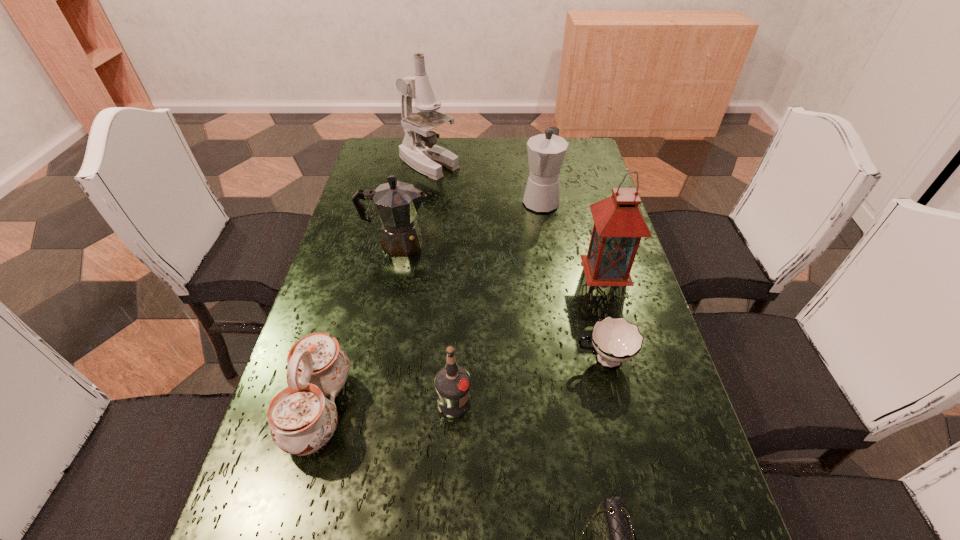
Find the location of `vacant space situated on the left of the seventh shortest object`. vacant space situated on the left of the seventh shortest object is located at coordinates (439, 270).

Locate an element on the screen. vacant space situated 0.230m on the front of the seventh nearest object is located at coordinates (552, 271).

Where is `free space located 0.150m on the pouring side of the nearer coffeepot`? free space located 0.150m on the pouring side of the nearer coffeepot is located at coordinates (484, 244).

The height and width of the screenshot is (540, 960). I want to click on free space located 0.160m on the front label of the vodka, so click(x=549, y=402).

This screenshot has width=960, height=540. In order to click on free space located by the handle of the chinaware in this screenshot , I will do `click(412, 409)`.

The image size is (960, 540). What are the coordinates of `vacant space positioned 0.350m on the side of the cup with the handle` in the screenshot? It's located at [x=418, y=359].

Find the location of `free space located on the side of the cup with the handle`. free space located on the side of the cup with the handle is located at coordinates (453, 359).

Find the location of a particular element. The image size is (960, 540). vacant space situated on the side of the cup with the handle is located at coordinates (485, 359).

Identify the location of object at the far edge. The image size is (960, 540). (418, 149).

The height and width of the screenshot is (540, 960). I want to click on microscope that is positioned at the left edge, so click(x=418, y=149).